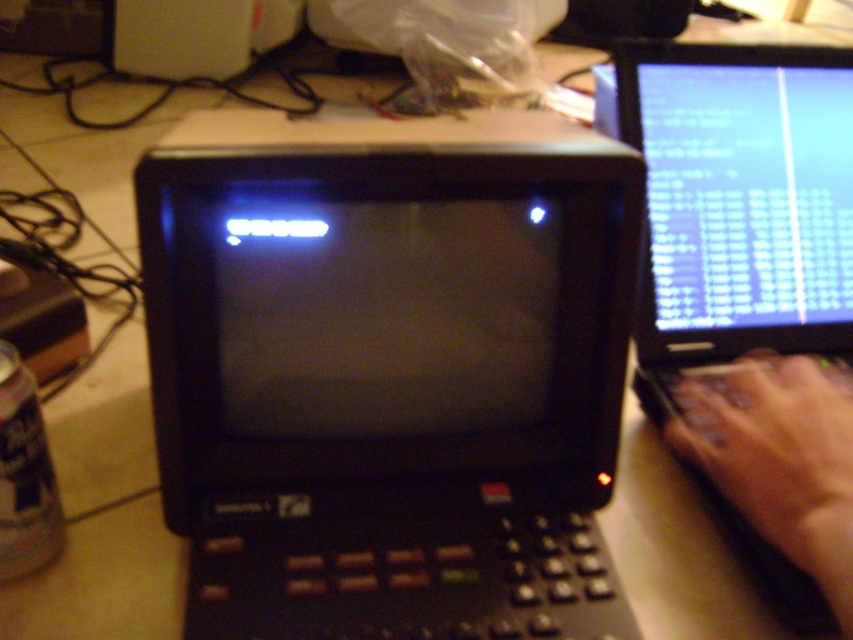
Measure the distance between black plastic monitor at center and matte skin hand at right.

They are 8.64 inches apart.

Does black plastic monitor at center have a larger size compared to matte skin hand at right?

Correct, black plastic monitor at center is larger in size than matte skin hand at right.

Which is behind, point (276, 260) or point (764, 388)?

The point (764, 388) is behind.

Where is `black plastic monitor at center`? black plastic monitor at center is located at coordinates [387, 372].